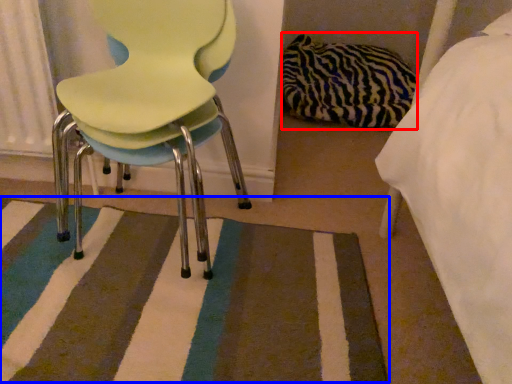
Question: Which object appears farthest to the camera in this image, material (highlighted by a red box) or mat (highlighted by a blue box)?

Choices:
 (A) material
 (B) mat

Answer: (A)